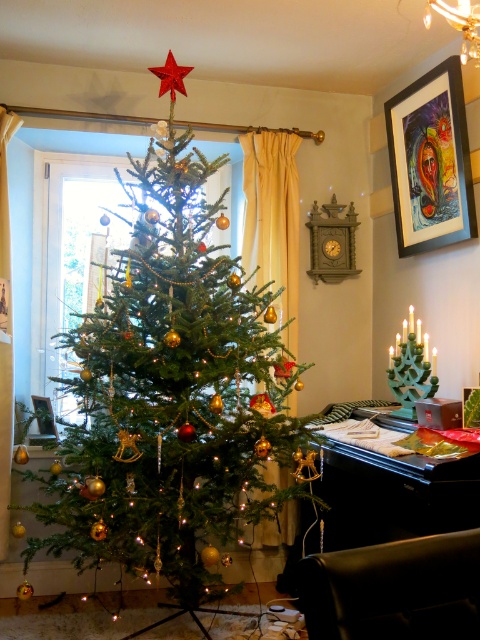
Question: Observing the image, what is the correct spatial positioning of black polished piano at lower center in reference to brushed metal picture frame at lower left?

Choices:
 (A) right
 (B) left

Answer: (A)

Question: Does green matte christmas tree at center have a smaller size compared to metallic gold picture frame at center?

Choices:
 (A) yes
 (B) no

Answer: (B)

Question: Which object is the farthest from the black matte picture frame at upper right?

Choices:
 (A) black polished piano at lower center
 (B) metallic red star at upper center
 (C) brushed metal picture frame at lower left

Answer: (C)

Question: Does green matte christmas tree at center appear over brushed metal picture frame at lower left?

Choices:
 (A) no
 (B) yes

Answer: (B)

Question: Which point is closer to the camera taking this photo?

Choices:
 (A) (156, 72)
 (B) (472, 196)

Answer: (A)

Question: Based on their relative distances, which object is farther from the metallic gold picture frame at center?

Choices:
 (A) green matte christmas tree at center
 (B) brushed metal picture frame at lower left
 (C) black matte picture frame at upper right

Answer: (B)